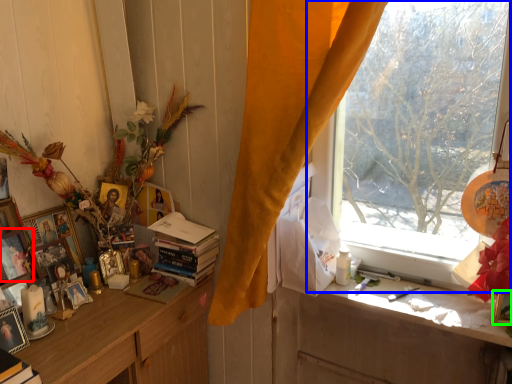
Question: Based on their relative distances, which object is nearer to picture frame (highlighted by a red box)? Choose from window (highlighted by a blue box) and picture frame (highlighted by a green box).

Choices:
 (A) window
 (B) picture frame

Answer: (A)